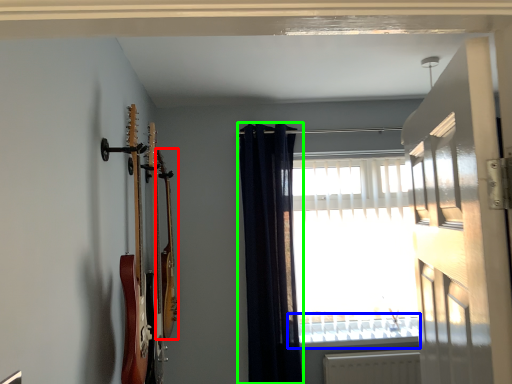
Question: Which object is the closest to the guitar (highlighted by a red box)? Choose among these: window sill (highlighted by a blue box) or curtain (highlighted by a green box).

Choices:
 (A) window sill
 (B) curtain

Answer: (B)